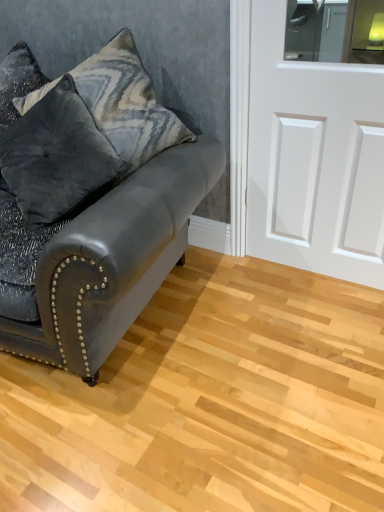
Where is `white matte door at right`? white matte door at right is located at coordinates (314, 158).

What is the approximate width of white matte door at right?

3.22 inches.

Image resolution: width=384 pixels, height=512 pixels. What do you see at coordinates (111, 261) in the screenshot?
I see `matte black leather couch at left` at bounding box center [111, 261].

What do you see at coordinates (127, 103) in the screenshot? I see `velvet gray pillow at upper left, which is the first pillow in top-to-bottom order` at bounding box center [127, 103].

Locate an element on the screen. velvet dark gray pillow at left, which is counted as the first pillow, starting from the bottom is located at coordinates (56, 156).

This screenshot has width=384, height=512. What are the coordinates of `white matte door at right` in the screenshot? It's located at (314, 158).

Is white matte door at right far from velvet dark gray pillow at left, which is counted as the first pillow, starting from the bottom?

No, white matte door at right is in close proximity to velvet dark gray pillow at left, which is counted as the first pillow, starting from the bottom.

Based on the photo, is white matte door at right oriented away from velvet dark gray pillow at left, which is counted as the 2th pillow, starting from the top?

No, white matte door at right is not facing away from velvet dark gray pillow at left, which is counted as the 2th pillow, starting from the top.

Considering the positions of point (334, 75) and point (30, 142), is point (334, 75) closer or farther from the camera than point (30, 142)?

Point (334, 75) is positioned farther from the camera compared to point (30, 142).

This screenshot has height=512, width=384. In order to click on door located behind the velvet dark gray pillow at left, which is counted as the 2th pillow, starting from the top in this screenshot , I will do `click(314, 158)`.

Which object is closer to the camera, white matte door at right or matte black leather couch at left?

matte black leather couch at left is in front.

Is white matte door at right far from matte black leather couch at left?

No, white matte door at right is not far from matte black leather couch at left.

Which of these two, white matte door at right or matte black leather couch at left, stands shorter?

Standing shorter between the two is matte black leather couch at left.

This screenshot has height=512, width=384. There is a matte black leather couch at left. Identify the location of the 1st pillow above it (from a real-world perspective). (56, 156).

Is matte black leather couch at left with velvet dark gray pillow at left, which is counted as the first pillow, starting from the bottom?

They are not placed beside each other.

Which is in front, point (80, 222) or point (96, 156)?

The point (80, 222) is closer to the camera.

Which object is closer to the camera, matte black leather couch at left or velvet dark gray pillow at left, which is counted as the first pillow, starting from the bottom?

matte black leather couch at left is more forward.

Does velvet gray pillow at upper left, which is the first pillow in top-to-bottom order, touch velvet dark gray pillow at left, which is counted as the first pillow, starting from the bottom?

No, velvet gray pillow at upper left, which is the first pillow in top-to-bottom order, is not with velvet dark gray pillow at left, which is counted as the first pillow, starting from the bottom.

From the image's perspective, is velvet gray pillow at upper left, which is the first pillow in top-to-bottom order, above velvet dark gray pillow at left, which is counted as the 2th pillow, starting from the top?

Yes, from the image's perspective, velvet gray pillow at upper left, which is the first pillow in top-to-bottom order, is on top of velvet dark gray pillow at left, which is counted as the 2th pillow, starting from the top.

Can we say velvet gray pillow at upper left, which is the first pillow in top-to-bottom order, lies outside velvet dark gray pillow at left, which is counted as the 2th pillow, starting from the top?

Yes, velvet gray pillow at upper left, which is the first pillow in top-to-bottom order, is outside of velvet dark gray pillow at left, which is counted as the 2th pillow, starting from the top.

Does velvet gray pillow at upper left, the second pillow positioned from the bottom, have a greater height compared to velvet dark gray pillow at left, which is counted as the 2th pillow, starting from the top?

Yes.

Considering the sizes of velvet dark gray pillow at left, which is counted as the first pillow, starting from the bottom, and white matte door at right in the image, is velvet dark gray pillow at left, which is counted as the first pillow, starting from the bottom, taller or shorter than white matte door at right?

Clearly, velvet dark gray pillow at left, which is counted as the first pillow, starting from the bottom, is shorter compared to white matte door at right.

Considering the sizes of objects velvet dark gray pillow at left, which is counted as the 2th pillow, starting from the top, and white matte door at right in the image provided, who is wider, velvet dark gray pillow at left, which is counted as the 2th pillow, starting from the top, or white matte door at right?

With larger width is velvet dark gray pillow at left, which is counted as the 2th pillow, starting from the top.

What's the angular difference between matte black leather couch at left and white matte door at right's facing directions?

10.1 degrees separate the facing orientations of matte black leather couch at left and white matte door at right.

Which is behind, point (40, 341) or point (375, 216)?

The point (375, 216) is farther from the camera.

Considering the sizes of objects matte black leather couch at left and white matte door at right in the image provided, who is shorter, matte black leather couch at left or white matte door at right?

matte black leather couch at left is shorter.

Are matte black leather couch at left and white matte door at right far apart?

No, matte black leather couch at left is not far from white matte door at right.

How different are the orientations of velvet dark gray pillow at left, which is counted as the 2th pillow, starting from the top, and velvet gray pillow at upper left, which is the first pillow in top-to-bottom order, in degrees?

They differ by 0.000838 degrees in their facing directions.

Is velvet dark gray pillow at left, which is counted as the first pillow, starting from the bottom, aimed at velvet gray pillow at upper left, which is the first pillow in top-to-bottom order?

No, velvet dark gray pillow at left, which is counted as the first pillow, starting from the bottom, does not turn towards velvet gray pillow at upper left, which is the first pillow in top-to-bottom order.

Is velvet dark gray pillow at left, which is counted as the 2th pillow, starting from the top, not within velvet gray pillow at upper left, the second pillow positioned from the bottom?

Absolutely, velvet dark gray pillow at left, which is counted as the 2th pillow, starting from the top, is external to velvet gray pillow at upper left, the second pillow positioned from the bottom.

Does velvet dark gray pillow at left, which is counted as the 2th pillow, starting from the top, come in front of velvet gray pillow at upper left, which is the first pillow in top-to-bottom order?

Yes, velvet dark gray pillow at left, which is counted as the 2th pillow, starting from the top, is closer to the viewer.

You are a GUI agent. You are given a task and a screenshot of the screen. Output one action in this format:
    pyautogui.click(x=<x>, y=<y>)
    Task: Click on the pillow lying in front of the white matte door at right
    
    Given the screenshot: What is the action you would take?
    pyautogui.click(x=56, y=156)

In the image, there is a matte black leather couch at left. At what (x,y) coordinates should I click in order to perform the action: click on door above it (from the image's perspective). Please return your answer as a coordinate pair (x, y). The height and width of the screenshot is (512, 384). Looking at the image, I should click on (314, 158).

Looking at this image, looking at the image, which one is located closer to white matte door at right, velvet dark gray pillow at left, which is counted as the 2th pillow, starting from the top, or matte black leather couch at left?

Based on the image, matte black leather couch at left appears to be nearer to white matte door at right.

Looking at the image, which one is located closer to matte black leather couch at left, white matte door at right or velvet gray pillow at upper left, the second pillow positioned from the bottom?

Among the two, velvet gray pillow at upper left, the second pillow positioned from the bottom, is located nearer to matte black leather couch at left.

Which object lies further to the anchor point velvet dark gray pillow at left, which is counted as the 2th pillow, starting from the top, white matte door at right or velvet gray pillow at upper left, the second pillow positioned from the bottom?

white matte door at right lies further to velvet dark gray pillow at left, which is counted as the 2th pillow, starting from the top, than the other object.

In the scene shown: Considering their positions, is velvet dark gray pillow at left, which is counted as the 2th pillow, starting from the top, positioned closer to matte black leather couch at left than white matte door at right?

The object closer to matte black leather couch at left is velvet dark gray pillow at left, which is counted as the 2th pillow, starting from the top.

From the image, which object appears to be farther from velvet dark gray pillow at left, which is counted as the 2th pillow, starting from the top, velvet gray pillow at upper left, which is the first pillow in top-to-bottom order, or matte black leather couch at left?

matte black leather couch at left.

Looking at the image, which one is located closer to velvet gray pillow at upper left, which is the first pillow in top-to-bottom order, matte black leather couch at left or white matte door at right?

matte black leather couch at left is closer to velvet gray pillow at upper left, which is the first pillow in top-to-bottom order.

Looking at the image, which one is located further to velvet gray pillow at upper left, the second pillow positioned from the bottom, matte black leather couch at left or velvet dark gray pillow at left, which is counted as the 2th pillow, starting from the top?

matte black leather couch at left lies further to velvet gray pillow at upper left, the second pillow positioned from the bottom, than the other object.

Estimate the real-world distances between objects in this image. Which object is further from white matte door at right, velvet gray pillow at upper left, the second pillow positioned from the bottom, or matte black leather couch at left?

Among the two, matte black leather couch at left is located further to white matte door at right.

Identify the location of pillow between velvet gray pillow at upper left, which is the first pillow in top-to-bottom order, and matte black leather couch at left, in the vertical direction. The height and width of the screenshot is (512, 384). (56, 156).

At what (x,y) coordinates should I click in order to perform the action: click on pillow between velvet dark gray pillow at left, which is counted as the first pillow, starting from the bottom, and white matte door at right, in the horizontal direction. Please return your answer as a coordinate pair (x, y). The width and height of the screenshot is (384, 512). Looking at the image, I should click on (127, 103).